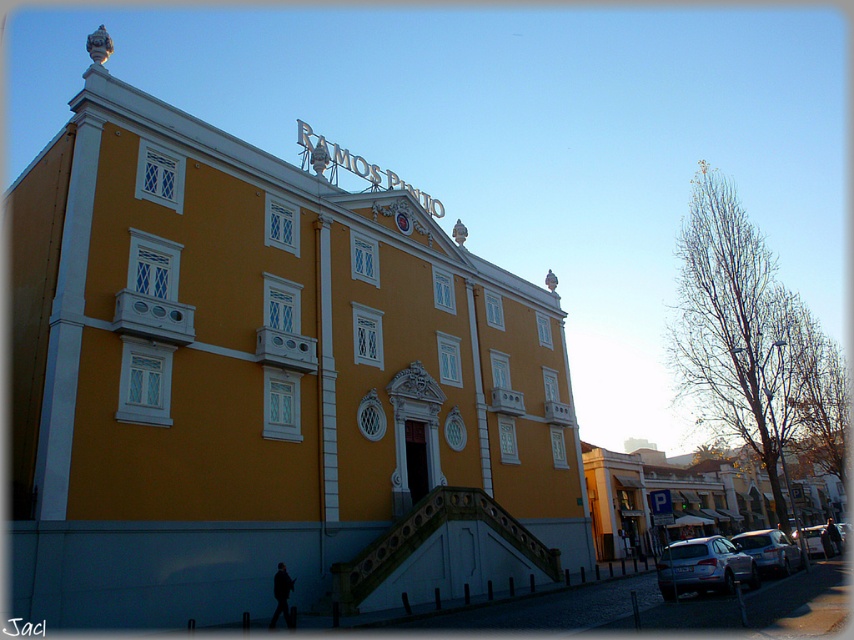
Does satin silver suv at lower right have a lesser height compared to satin silver car at lower right?

Correct, satin silver suv at lower right is not as tall as satin silver car at lower right.

Is satin silver suv at lower right in front of satin silver car at lower right?

Yes, it is.

Who is more forward, (x=691, y=584) or (x=740, y=547)?

Point (x=691, y=584) is more forward.

Locate an element on the screen. satin silver suv at lower right is located at coordinates (703, 566).

Which is in front, point (501, 337) or point (820, 524)?

Positioned in front is point (501, 337).

The height and width of the screenshot is (640, 854). Identify the location of yellow matte building at center. (266, 381).

At what (x,y) coordinates should I click in order to perform the action: click on satin silver suv at lower right. Please return your answer as a coordinate pair (x, y). Looking at the image, I should click on (703, 566).

Is point (724, 554) positioned behind point (828, 547)?

No, (724, 554) is in front of (828, 547).

Where is `satin silver suv at lower right`? The width and height of the screenshot is (854, 640). satin silver suv at lower right is located at coordinates (703, 566).